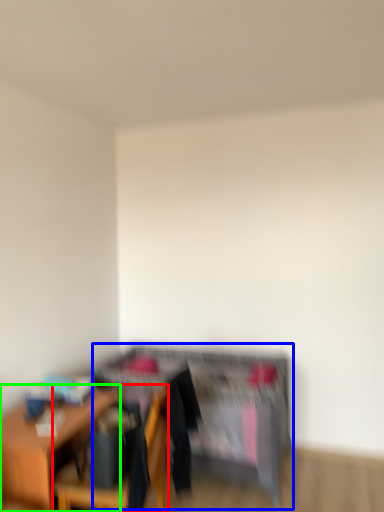
Question: Based on their relative distances, which object is nearer to chair (highlighted by a red box)? Choose from dresser (highlighted by a blue box) and table (highlighted by a green box).

Choices:
 (A) dresser
 (B) table

Answer: (B)